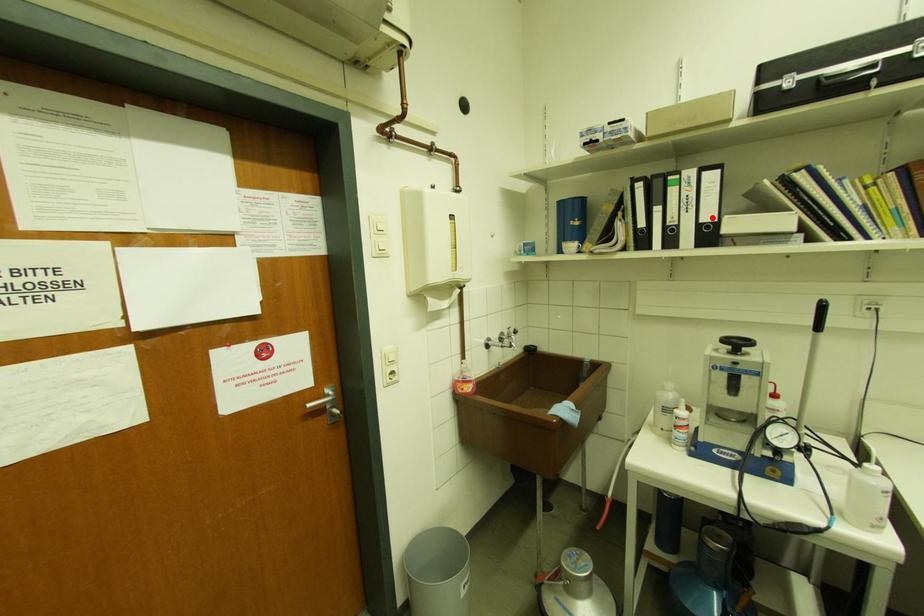
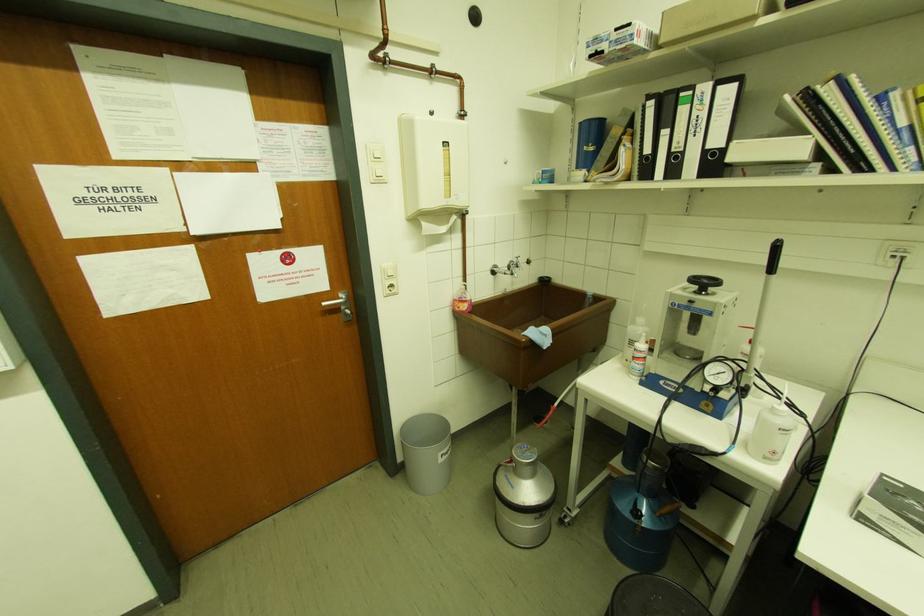
The point at the highlighted location is marked in the first image. Where is the corresponding point in the second image?

(720, 143)